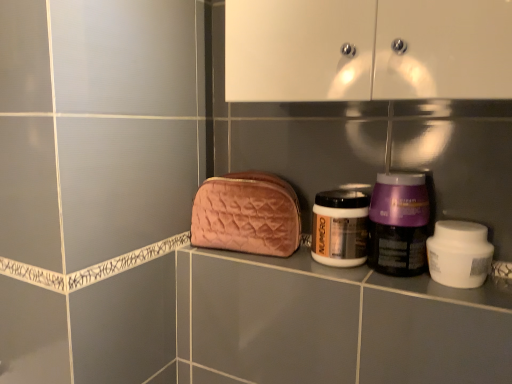
Question: Does point (202, 218) appear closer or farther from the camera than point (390, 195)?

Choices:
 (A) closer
 (B) farther

Answer: (B)

Question: Considering their positions, is velvet pink pouch at center located in front of or behind purple glossy jar at center-right, the 1th bottle when ordered from right to left?

Choices:
 (A) behind
 (B) front

Answer: (A)

Question: Estimate the real-world distances between objects in this image. Which object is farther from the white matte jar at right?

Choices:
 (A) purple glossy jar at center-right, marked as the second bottle in a left-to-right arrangement
 (B) matte gold jar at center, the second bottle positioned from the right
 (C) velvet pink pouch at center

Answer: (C)

Question: Considering the real-world distances, which object is closest to the matte gold jar at center, the second bottle positioned from the right?

Choices:
 (A) velvet pink pouch at center
 (B) white matte jar at right
 (C) purple glossy jar at center-right, the 1th bottle when ordered from right to left

Answer: (C)